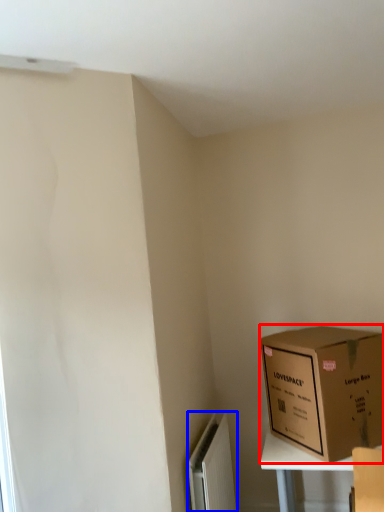
Question: Among these objects, which one is nearest to the camera, box (highlighted by a red box) or radiator (highlighted by a blue box)?

Choices:
 (A) box
 (B) radiator

Answer: (B)